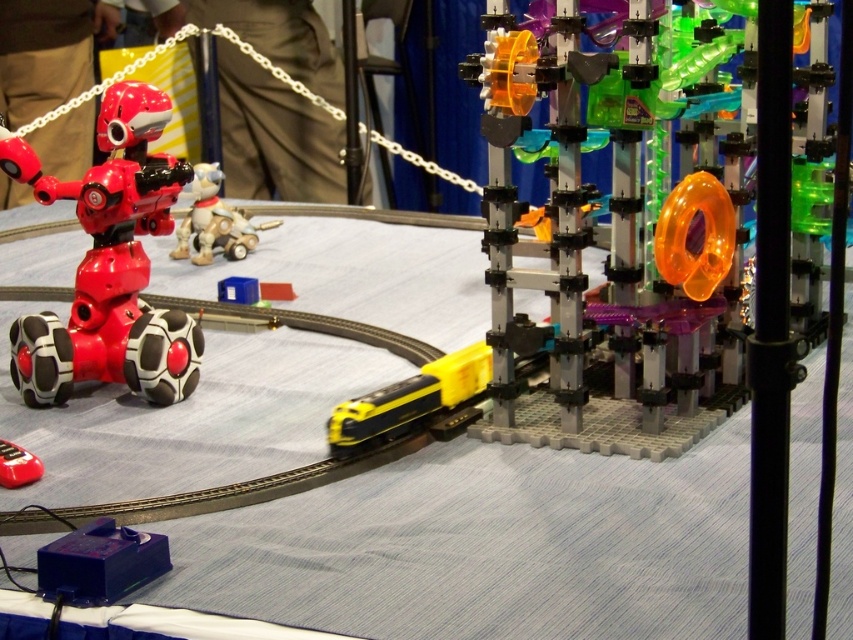
Can you confirm if shiny red robot at left is positioned to the right of plush white dog at center?

Incorrect, shiny red robot at left is not on the right side of plush white dog at center.

From the picture: Is shiny red robot at left shorter than plush white dog at center?

No, shiny red robot at left is not shorter than plush white dog at center.

Consider the image. Who is more forward, (117, 342) or (210, 248)?

Point (117, 342)

What are the coordinates of `shiny red robot at left` in the screenshot? It's located at (109, 266).

Can you confirm if translucent orange plastic gear at center is smaller than plush white dog at center?

Incorrect, translucent orange plastic gear at center is not smaller in size than plush white dog at center.

Which is below, translucent orange plastic gear at center or plush white dog at center?

Positioned lower is translucent orange plastic gear at center.

Image resolution: width=853 pixels, height=640 pixels. Identify the location of translucent orange plastic gear at center. (596, 428).

Does shiny red robot at left have a smaller size compared to translucent orange plastic gear at center?

Yes, shiny red robot at left is smaller than translucent orange plastic gear at center.

Who is shorter, shiny red robot at left or translucent orange plastic gear at center?

shiny red robot at left is shorter.

Is point (80, 216) positioned before point (622, 420)?

No, it is behind (622, 420).

Image resolution: width=853 pixels, height=640 pixels. In order to click on shiny red robot at left in this screenshot , I will do `click(109, 266)`.